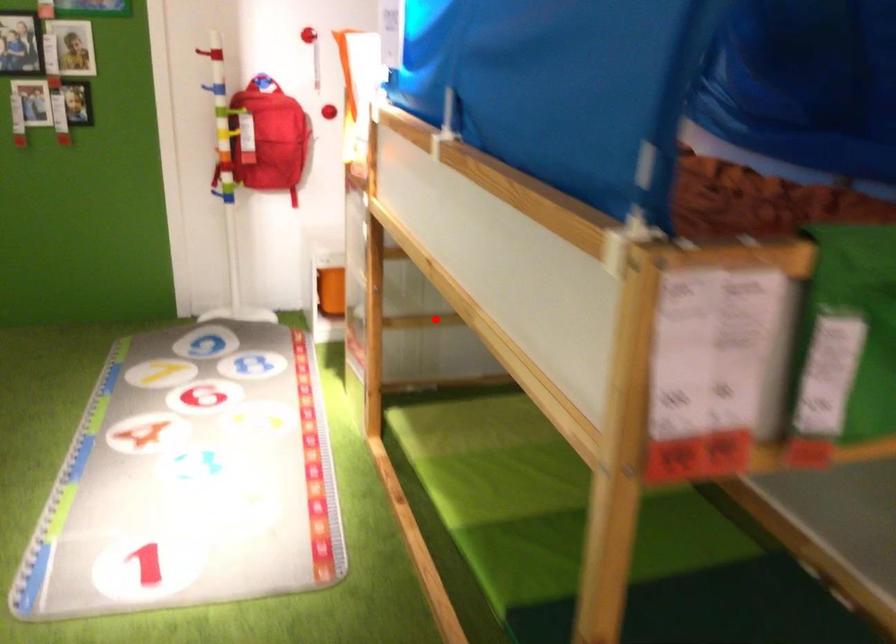
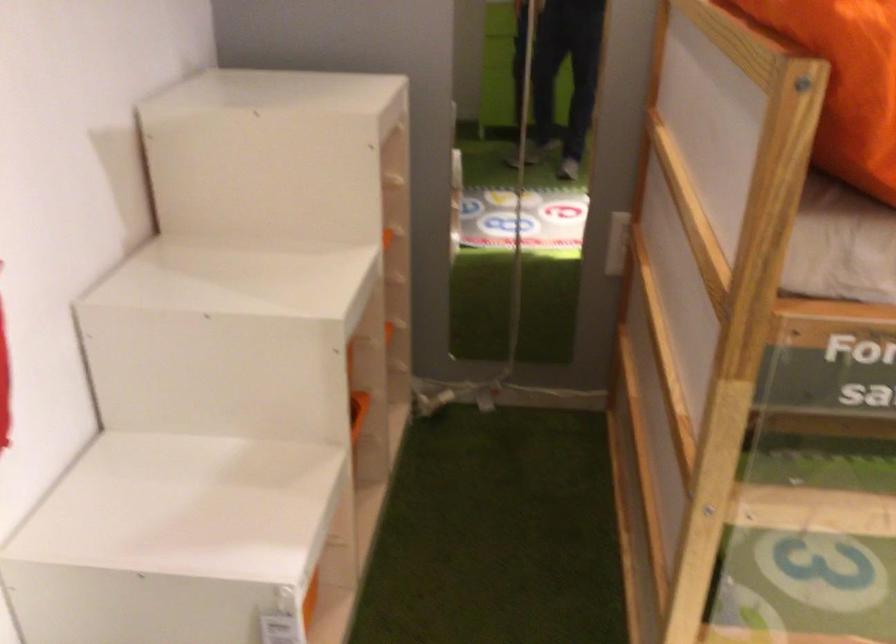
Question: I am providing you with two images of the same scene from different viewpoints. Given a red point in image1, look at the same physical point in image2. Is it:

Choices:
 (A) Closer to the viewpoint
 (B) Farther from the viewpoint

Answer: (A)